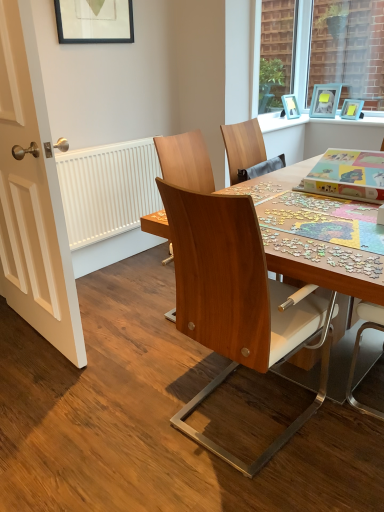
Identify the location of unoccupied space behind white painted wood door at left. Image resolution: width=384 pixels, height=512 pixels. (114, 283).